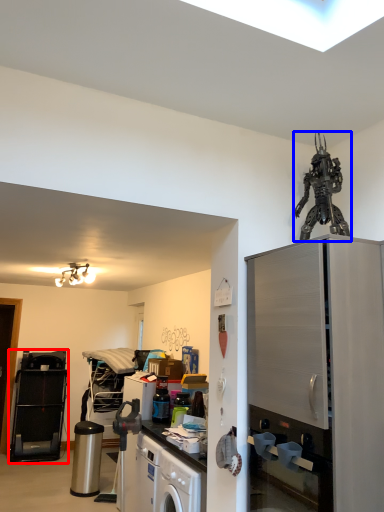
Question: Which point is further to the camera, appliance (highlighted by a red box) or toy (highlighted by a blue box)?

Choices:
 (A) appliance
 (B) toy

Answer: (A)